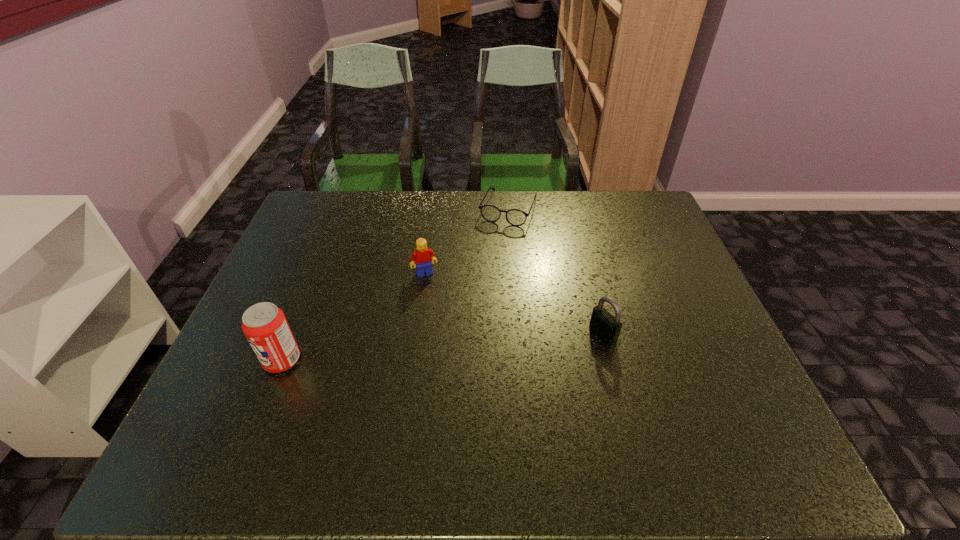
The height and width of the screenshot is (540, 960). Identify the location of vacant space located on the face of the second object from left to right. (436, 296).

This screenshot has height=540, width=960. I want to click on vacant space located 0.290m on the face of the second object from left to right, so click(460, 357).

The height and width of the screenshot is (540, 960). I want to click on free space located on the front-facing side of the spectacles, so click(482, 274).

What are the coordinates of `free space located on the front-facing side of the spectacles` in the screenshot? It's located at (495, 240).

I want to click on free space located on the front-facing side of the spectacles, so click(x=481, y=276).

Where is `object that is at the far edge`? This screenshot has height=540, width=960. object that is at the far edge is located at coordinates 515,217.

Where is `object that is positioned at the left edge`? object that is positioned at the left edge is located at coordinates (265, 326).

You are a GUI agent. You are given a task and a screenshot of the screen. Output one action in this format:
    pyautogui.click(x=<x>, y=<y>)
    Task: Click on the free region at the far edge of the desktop
    
    Given the screenshot: What is the action you would take?
    pyautogui.click(x=591, y=217)

In the image, there is a desktop. Identify the location of free space at the near edge. The height and width of the screenshot is (540, 960). (620, 392).

I want to click on free space at the left edge, so click(306, 284).